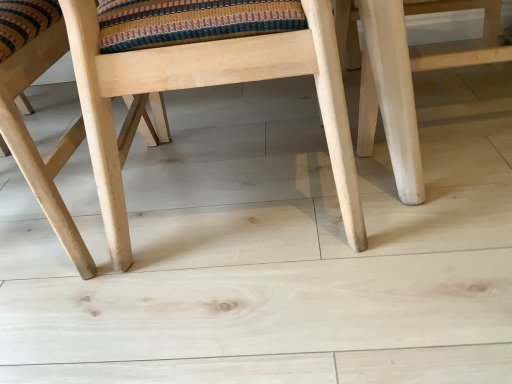
Find the location of a particular element. Image resolution: width=512 pixels, height=384 pixels. vacant area to the right of natural wood chair at center, the second chair from the left is located at coordinates [x=439, y=175].